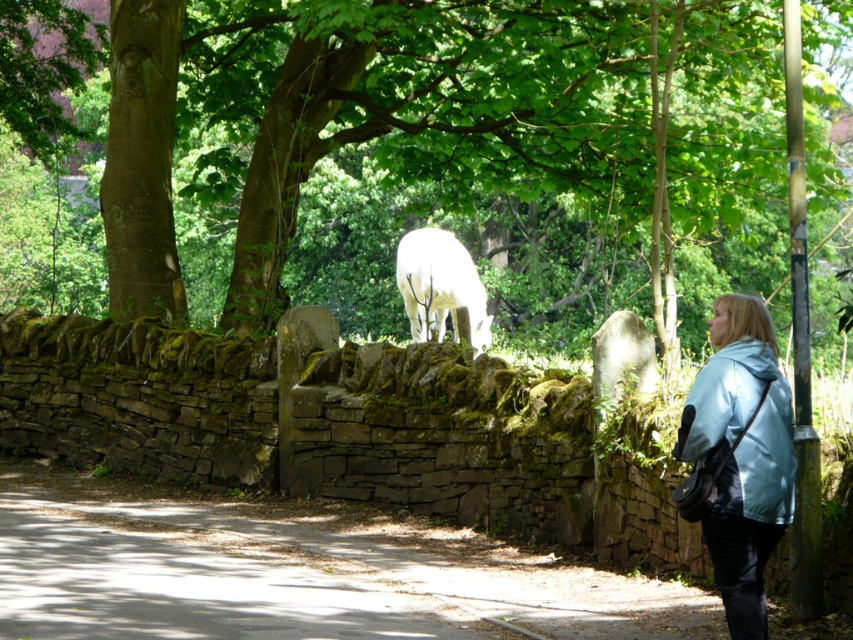
Is green leafy tree at upper center below light blue fabric at right?

Actually, green leafy tree at upper center is above light blue fabric at right.

Does point (560, 260) come farther from viewer compared to point (683, 408)?

Yes, it is behind point (683, 408).

Identify the location of green leafy tree at upper center. (422, 163).

Can you confirm if dirt path at lower center is taller than light blue fabric at right?

No.

Is point (408, 630) in front of point (724, 483)?

No, it is behind (724, 483).

Describe the element at coordinates (294, 570) in the screenshot. I see `dirt path at lower center` at that location.

Find the location of a particular element. The width and height of the screenshot is (853, 640). dirt path at lower center is located at coordinates (294, 570).

Find the location of a particular element. dirt path at lower center is located at coordinates (294, 570).

Can you confirm if dirt path at lower center is taller than white woolly goat at center?

No, dirt path at lower center is not taller than white woolly goat at center.

At what (x,y) coordinates should I click in order to perform the action: click on dirt path at lower center. Please return your answer as a coordinate pair (x, y). Looking at the image, I should click on (294, 570).